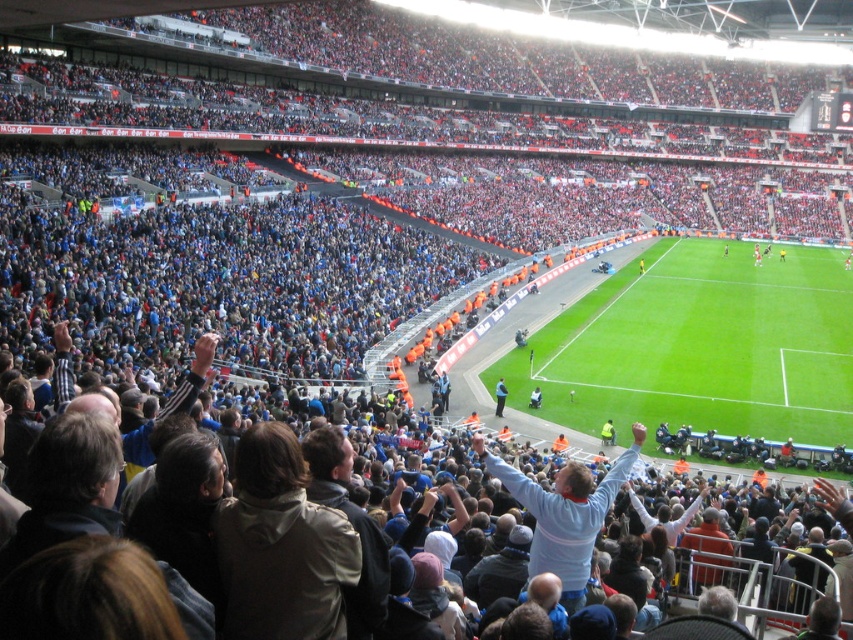
Question: Which point is farther to the camera?

Choices:
 (A) (810, 369)
 (B) (492, 467)

Answer: (A)

Question: From the image, what is the correct spatial relationship of green grass football field at center in relation to light blue jersey at center?

Choices:
 (A) below
 (B) above

Answer: (B)

Question: Which object is farther from the camera taking this photo?

Choices:
 (A) light blue jersey at center
 (B) green grass football field at center

Answer: (B)

Question: Which of the following is the farthest from the observer?

Choices:
 (A) light blue jersey at center
 (B) green grass football field at center

Answer: (B)

Question: Is green grass football field at center smaller than light blue jersey at center?

Choices:
 (A) yes
 (B) no

Answer: (B)

Question: Is green grass football field at center in front of light blue jersey at center?

Choices:
 (A) yes
 (B) no

Answer: (B)